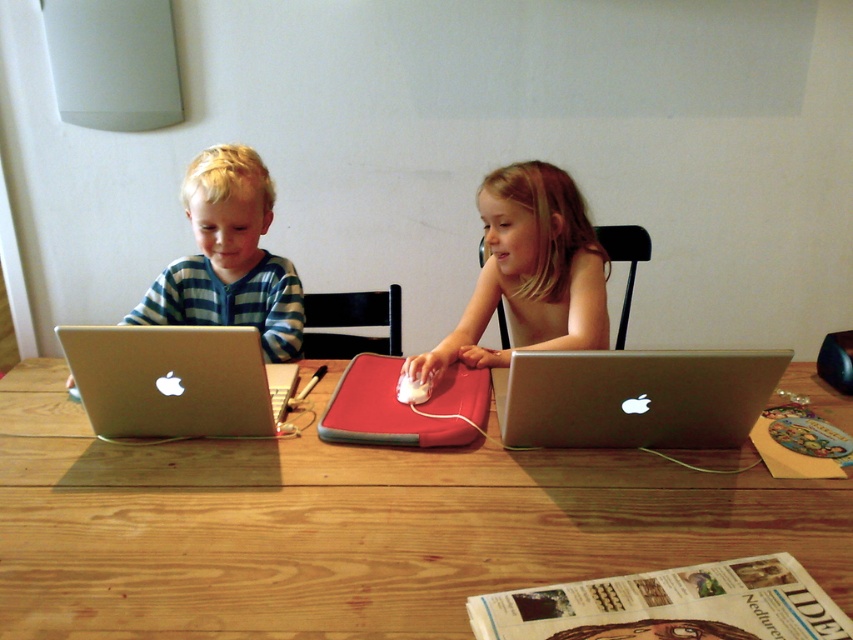
Find the location of a particular element. wooden table at center is located at coordinates (351, 525).

At what (x,y) coordinates should I click in order to perform the action: click on wooden table at center. Please return your answer as a coordinate pair (x, y). This screenshot has height=640, width=853. Looking at the image, I should click on (351, 525).

Can you confirm if silver metallic laptop at center is shorter than matte silver laptop at left?

Indeed, silver metallic laptop at center has a lesser height compared to matte silver laptop at left.

Which is in front, point (647, 355) or point (219, 216)?

Point (647, 355) is in front.

Identify the location of silver metallic laptop at center. Image resolution: width=853 pixels, height=640 pixels. (634, 397).

Who is positioned more to the left, smooth skin girl at center or matte silver laptop at left?

From the viewer's perspective, matte silver laptop at left appears more on the left side.

Can you confirm if smooth skin girl at center is bigger than matte silver laptop at left?

Yes.

At what (x,y) coordinates should I click in order to perform the action: click on smooth skin girl at center. Please return your answer as a coordinate pair (x, y). Looking at the image, I should click on (527, 273).

Where is `smooth skin girl at center`? This screenshot has height=640, width=853. smooth skin girl at center is located at coordinates (527, 273).